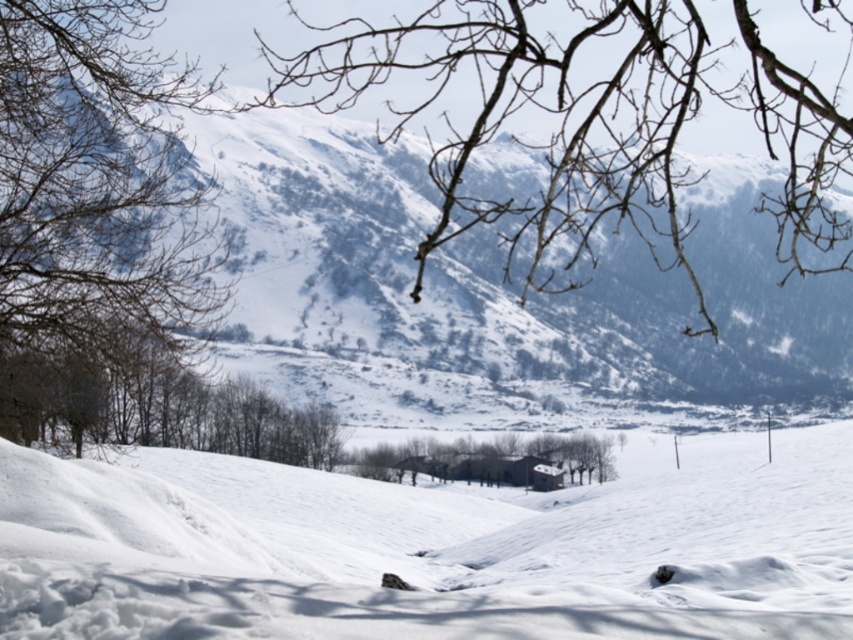
Does snowy white mountain at upper center have a greater width compared to bare branches at upper center?

Incorrect, snowy white mountain at upper center's width does not surpass bare branches at upper center's.

Between point (401, 273) and point (595, 182), which one is positioned behind?

The point (401, 273) is more distant.

What do you see at coordinates (494, 292) in the screenshot? I see `snowy white mountain at upper center` at bounding box center [494, 292].

Identify the location of snowy white mountain at upper center. (494, 292).

Between bare branches at upper center and brown wood house at center, which one has less height?

Standing shorter between the two is brown wood house at center.

Is bare branches at upper center below brown wood house at center?

No, bare branches at upper center is not below brown wood house at center.

The height and width of the screenshot is (640, 853). What do you see at coordinates (590, 125) in the screenshot?
I see `bare branches at upper center` at bounding box center [590, 125].

You are a GUI agent. You are given a task and a screenshot of the screen. Output one action in this format:
    pyautogui.click(x=<x>, y=<y>)
    Task: Click on the bare branches at upper center
    This screenshot has width=853, height=640.
    Given the screenshot: What is the action you would take?
    pyautogui.click(x=590, y=125)

Who is shorter, white snow at center or bare branches at left?

Standing shorter between the two is white snow at center.

Where is `white snow at center`? white snow at center is located at coordinates (x=432, y=547).